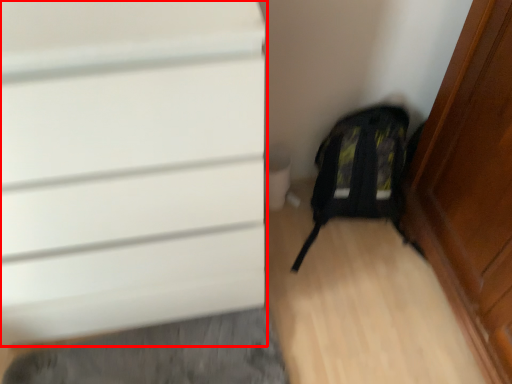
Question: From the image's perspective, what is the correct spatial positioning of door (annotated by the red box) in reference to backpack?

Choices:
 (A) below
 (B) above

Answer: (B)